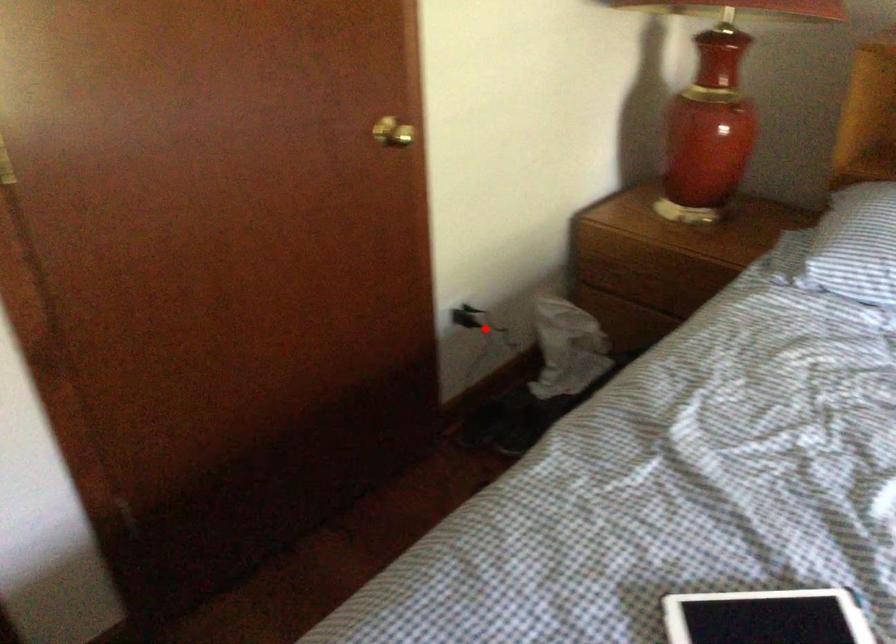
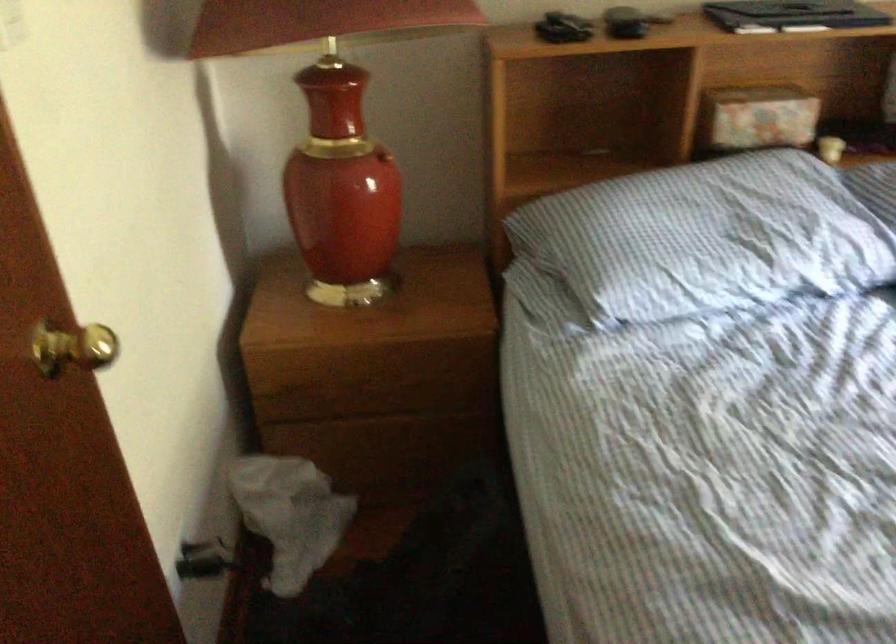
Where in the second image is the point corresponding to the highlighted location from the first image?

(204, 560)